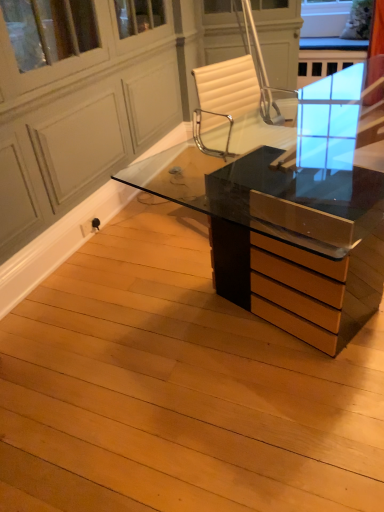
Question: In which direction should I rotate to look at transparent glass screen door at upper center?

Choices:
 (A) left
 (B) right

Answer: (A)

Question: Does matte black desk at center appear on the left side of transparent glass screen door at upper center?

Choices:
 (A) no
 (B) yes

Answer: (A)

Question: Is matte black desk at center thinner than transparent glass screen door at upper center?

Choices:
 (A) no
 (B) yes

Answer: (A)

Question: Is the position of matte black desk at center more distant than that of transparent glass screen door at upper center?

Choices:
 (A) yes
 (B) no

Answer: (A)

Question: Would you consider matte black desk at center to be distant from transparent glass screen door at upper center?

Choices:
 (A) no
 (B) yes

Answer: (B)

Question: Can you confirm if matte black desk at center is shorter than transparent glass screen door at upper center?

Choices:
 (A) yes
 (B) no

Answer: (A)

Question: Is transparent glass screen door at upper center located within matte black desk at center?

Choices:
 (A) yes
 (B) no

Answer: (B)

Question: Can you confirm if transparent glass screen door at upper center is taller than matte black desk at center?

Choices:
 (A) no
 (B) yes

Answer: (B)

Question: From a real-world perspective, is transparent glass screen door at upper center positioned under matte black desk at center based on gravity?

Choices:
 (A) no
 (B) yes

Answer: (A)

Question: Is transparent glass screen door at upper center not within matte black desk at center?

Choices:
 (A) no
 (B) yes

Answer: (B)

Question: Considering the relative sizes of transparent glass screen door at upper center and matte black desk at center in the image provided, is transparent glass screen door at upper center wider than matte black desk at center?

Choices:
 (A) no
 (B) yes

Answer: (A)

Question: Is transparent glass screen door at upper center shorter than matte black desk at center?

Choices:
 (A) yes
 (B) no

Answer: (B)

Question: Considering the relative positions of transparent glass screen door at upper center and matte black desk at center in the image provided, is transparent glass screen door at upper center to the right of matte black desk at center from the viewer's perspective?

Choices:
 (A) no
 (B) yes

Answer: (A)

Question: In the image, is matte black desk at center positioned in front of or behind transparent glass screen door at upper center?

Choices:
 (A) behind
 (B) front

Answer: (A)